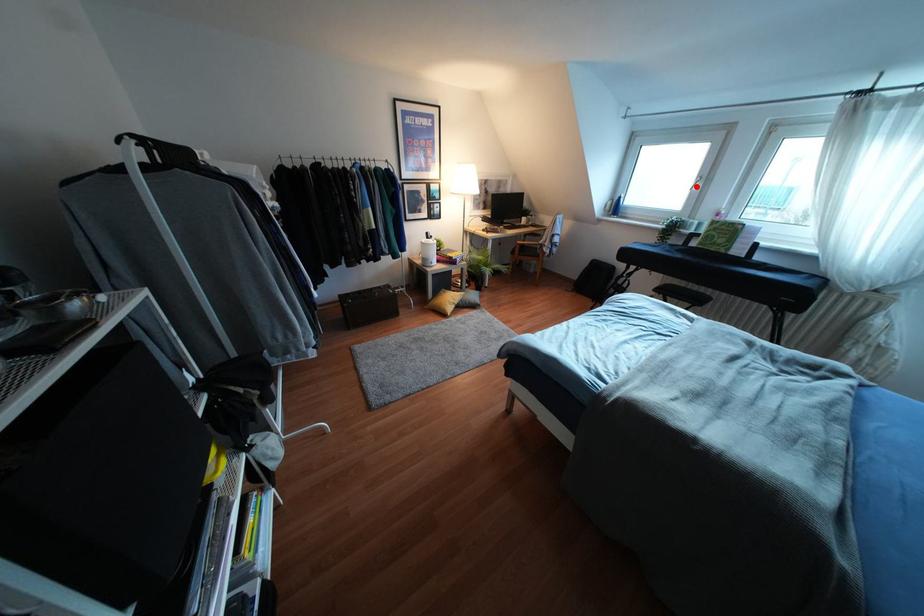
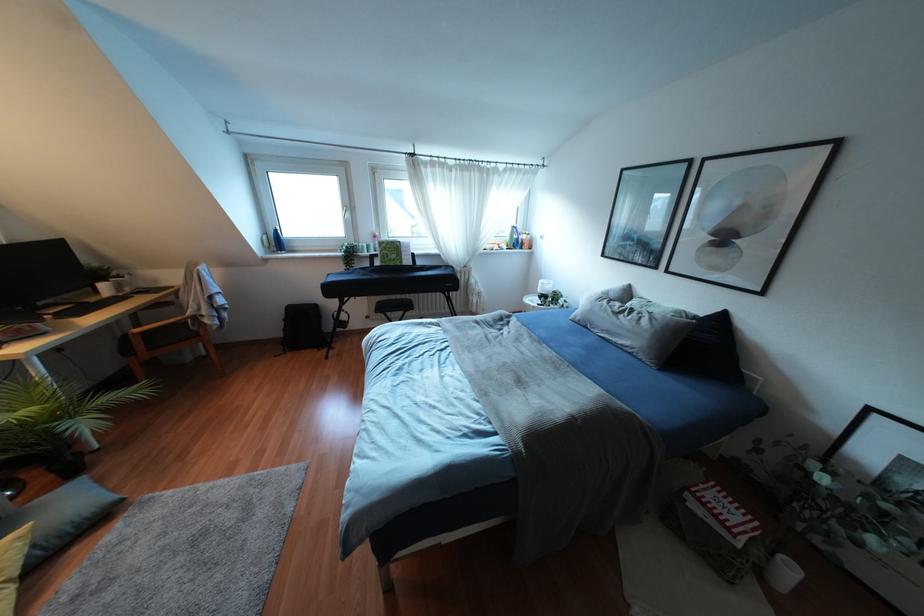
Question: I am providing you with two images of the same scene from different viewpoints. In image1, a red point is highlighted. Considering the same 3D point in image2, which of the following is correct?

Choices:
 (A) It is closer
 (B) It is farther

Answer: (A)